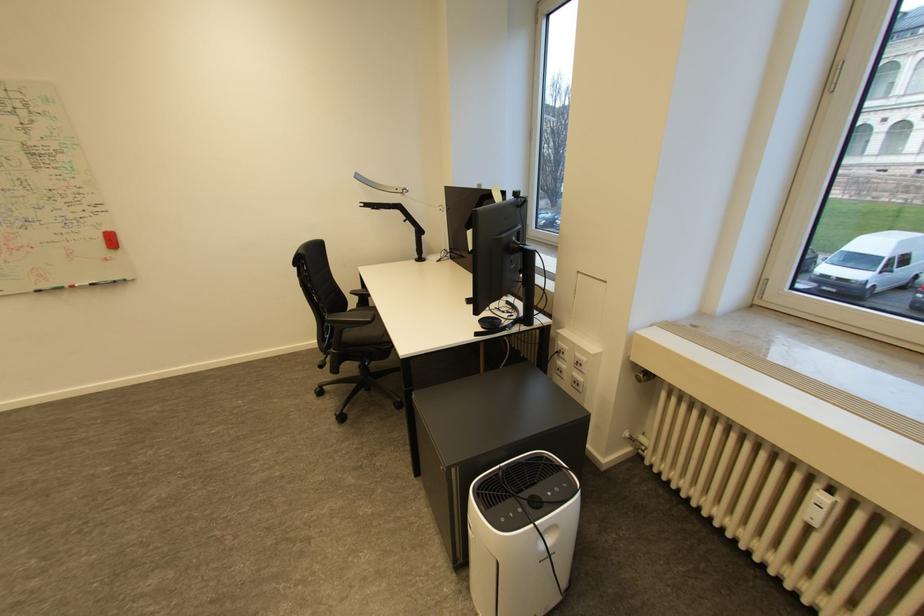
What do you see at coordinates (350, 318) in the screenshot? The height and width of the screenshot is (616, 924). I see `a chair armrest` at bounding box center [350, 318].